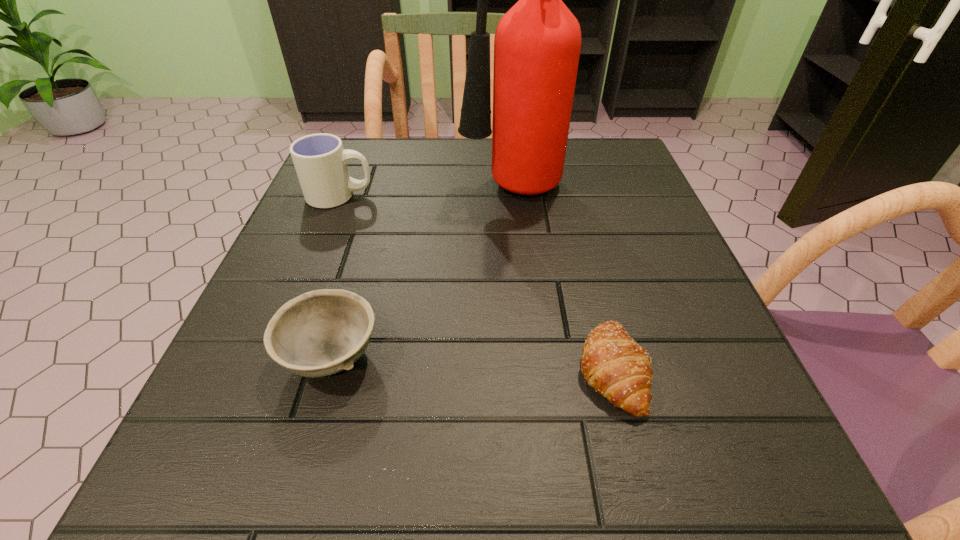
I want to click on fire extinguisher, so click(x=537, y=43).

This screenshot has height=540, width=960. What are the coordinates of `the second tallest object` in the screenshot? It's located at (320, 161).

Where is `bowl`? The width and height of the screenshot is (960, 540). bowl is located at coordinates (319, 333).

The width and height of the screenshot is (960, 540). I want to click on the shortest object, so click(613, 364).

Locate an element on the screen. The height and width of the screenshot is (540, 960). free space located at the nozzle of the fire extinguisher is located at coordinates (358, 192).

Find the location of a particular element. vacant space situated at the nozzle of the fire extinguisher is located at coordinates (329, 192).

Locate an element on the screen. vacant space located 0.220m at the nozzle of the fire extinguisher is located at coordinates (353, 192).

At what (x,y) coordinates should I click in order to perform the action: click on vacant space situated with the handle on the side of the third shortest object. Please return your answer as a coordinate pair (x, y). Looking at the image, I should click on (471, 196).

The height and width of the screenshot is (540, 960). In order to click on blank space located 0.160m on the back of the bowl in this screenshot , I will do `click(363, 250)`.

This screenshot has width=960, height=540. In order to click on vacant space located 0.310m on the back of the crescent roll in this screenshot , I will do `click(571, 206)`.